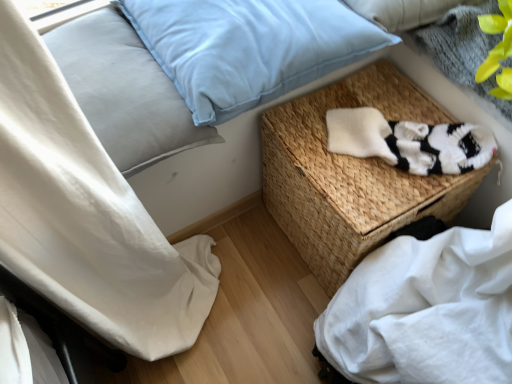
Find the location of a particular element. This screenshot has height=384, width=512. blank space to the left of woven wicker basket at center is located at coordinates (234, 273).